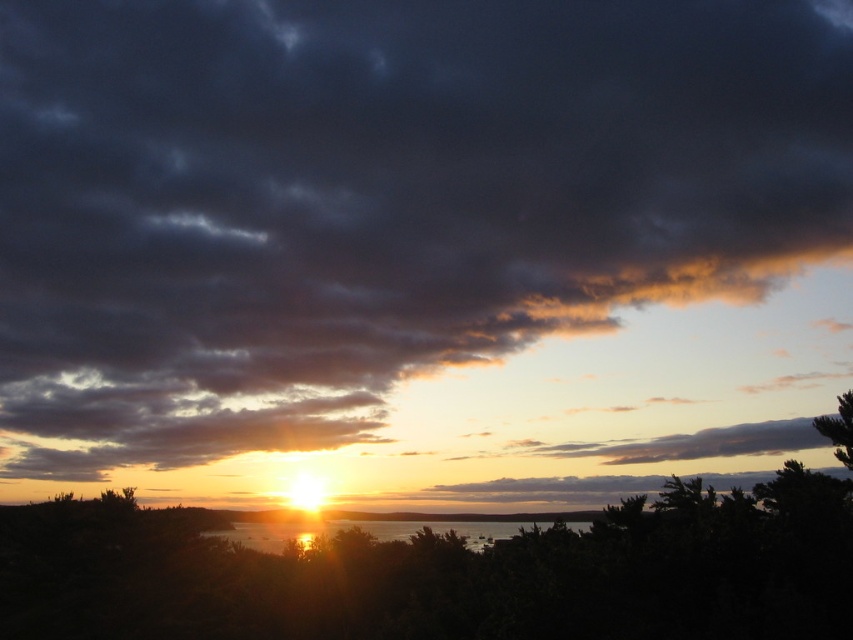
Question: Considering the relative positions of shiny reflective water at center and green leafy tree at lower right in the image provided, where is shiny reflective water at center located with respect to green leafy tree at lower right?

Choices:
 (A) below
 (B) above

Answer: (A)

Question: Is shiny reflective water at center wider than green leafy tree at lower right?

Choices:
 (A) yes
 (B) no

Answer: (B)

Question: Among these objects, which one is farthest from the camera?

Choices:
 (A) shiny reflective water at center
 (B) green leafy tree at lower right

Answer: (A)

Question: Which point is farther from the camera taking this photo?

Choices:
 (A) (842, 397)
 (B) (236, 538)

Answer: (B)

Question: From the image, what is the correct spatial relationship of shiny reflective water at center in relation to green leafy tree at lower right?

Choices:
 (A) below
 (B) above

Answer: (A)